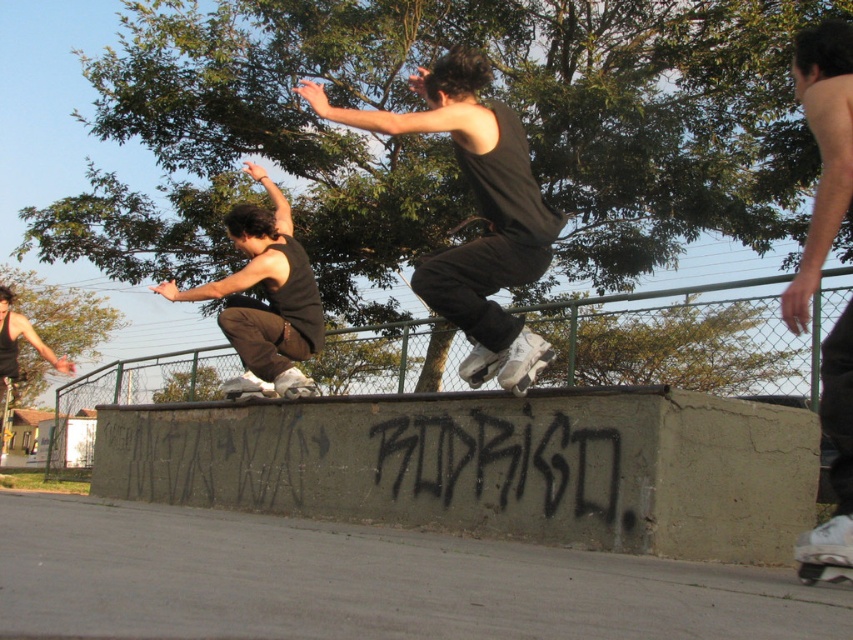
Is black matte tank top at center below shiny black tank top at upper right?

Yes.

Looking at this image, is black matte tank top at center smaller than shiny black tank top at upper right?

Actually, black matte tank top at center might be larger than shiny black tank top at upper right.

Between point (486, 234) and point (830, 477), which one is positioned in front?

Point (830, 477)

Identify the location of black matte tank top at center. (482, 211).

Based on the photo, does black matte tank top at center have a greater height compared to matte black tank top at center?

Correct, black matte tank top at center is much taller as matte black tank top at center.

Who is taller, black matte tank top at center or matte black tank top at center?

black matte tank top at center

Identify the location of black matte tank top at center. The image size is (853, 640). (482, 211).

This screenshot has width=853, height=640. Find the location of `black matte tank top at center`. black matte tank top at center is located at coordinates (482, 211).

What do you see at coordinates (822, 150) in the screenshot? I see `shiny black tank top at upper right` at bounding box center [822, 150].

Which is behind, point (824, 172) or point (283, 330)?

The point (283, 330) is behind.

Which is behind, point (849, 352) or point (276, 246)?

The point (276, 246) is more distant.

This screenshot has height=640, width=853. I want to click on shiny black tank top at upper right, so click(x=822, y=150).